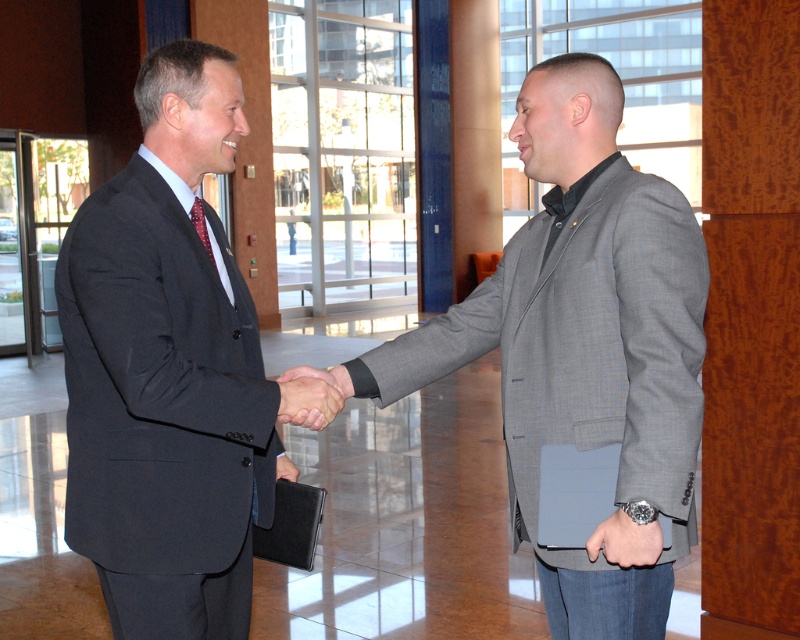
Between matte black suit at center and gray textured blazer at center, which one has more height?

matte black suit at center is taller.

Can you confirm if matte black suit at center is wider than gray textured blazer at center?

Incorrect, matte black suit at center's width does not surpass gray textured blazer at center's.

Which is in front, point (116, 257) or point (660, 600)?

Point (116, 257) is in front.

What are the coordinates of `matte black suit at center` in the screenshot? It's located at (168, 369).

Is point (634, 621) positioned behind point (310, 396)?

That is False.

Which is more to the left, gray textured blazer at center or matte black hand at center?

matte black hand at center

Does point (550, 624) come behind point (302, 381)?

Yes.

Where is `gray textured blazer at center`? gray textured blazer at center is located at coordinates (584, 348).

The width and height of the screenshot is (800, 640). I want to click on matte black suit at center, so click(x=168, y=369).

Can you confirm if matte black suit at center is taller than matte black hand at center?

Yes, matte black suit at center is taller than matte black hand at center.

Find the location of a particular element. The height and width of the screenshot is (640, 800). matte black suit at center is located at coordinates (168, 369).